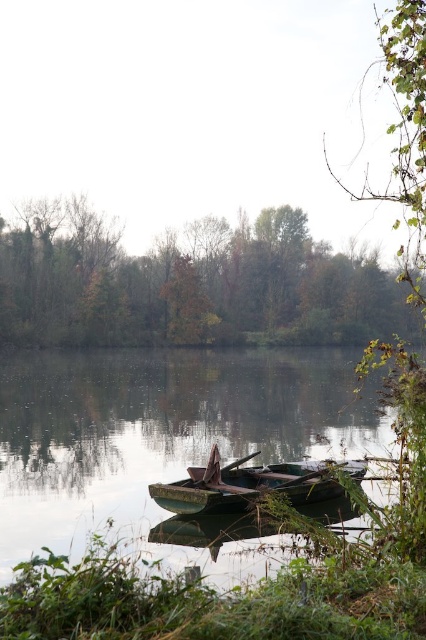
Question: Is green matte boat at center below rusty metal boat at center?

Choices:
 (A) no
 (B) yes

Answer: (A)

Question: Can you confirm if green leafy tree at upper center is positioned to the left of green leafy branch at upper right?

Choices:
 (A) yes
 (B) no

Answer: (A)

Question: From the image, what is the correct spatial relationship of green leafy tree at upper center in relation to rusty metal boat at center?

Choices:
 (A) below
 (B) above

Answer: (B)

Question: Which point appears closest to the camera in this image?

Choices:
 (A) tap(290, 465)
 (B) tap(106, 294)
 (C) tap(422, 285)

Answer: (C)

Question: Which point is farther to the camera?

Choices:
 (A) (112, 456)
 (B) (175, 508)

Answer: (A)

Question: Estimate the real-world distances between objects in this image. Which object is closer to the rusty metal boat at center?

Choices:
 (A) green matte boat at center
 (B) green leafy tree at upper center

Answer: (A)